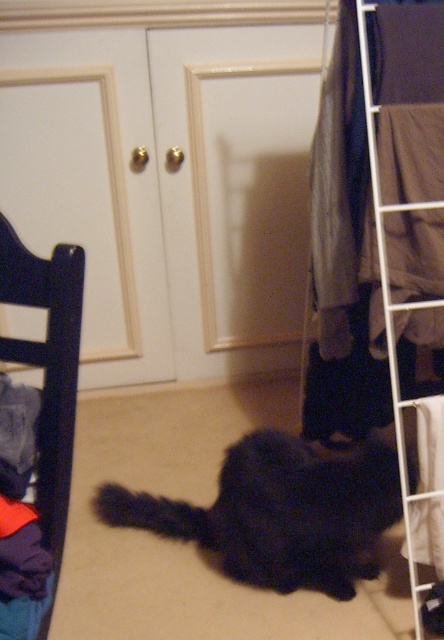
You are standing in the room and want to place a small plant pot between the dark wood chair at left and the white wire rack at right. Based on their positions, which object should the plant pot be nearer to if you want it placed closer to the front of the room?

The dark wood chair at left is closer to the viewer than the white wire rack at right, so to place the plant pot closer to the front of the room, it should be nearer to the dark wood chair at left.

Based on the photo, you are holding a 3.5 feet long pole and want to place it between the black fluffy cat at center and the wooden chair on the left. Is there enough space to fit the pole horizontally between them?

The distance between the black fluffy cat at center and the wooden chair on the left is 4.50 feet, which is greater than the pole length of 3.5 feet. Yes, there is enough space to fit the pole horizontally between them.

You are trying to decide whether to place a small decorative plant on the floor between the black fluffy cat at center and the dark wood chair at left. Considering their sizes, will the cat block the plant from being seen next to the chair?

The black fluffy cat at center is bigger than the dark wood chair at left, so the cat would likely block the plant from being seen next to the chair due to its larger size.